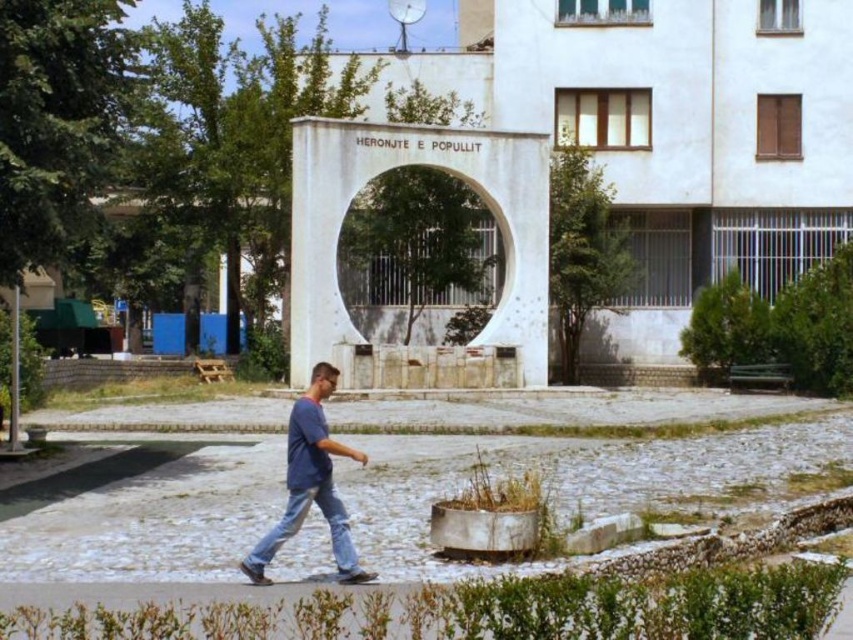
You are a photographer trying to capture the white concrete archway at center and the blue denim jeans at lower center in a single frame. Since you want both objects to be clearly visible, which object should you focus on first to ensure proper depth of field?

The white concrete archway at center is thinner than blue denim jeans at lower center, so you should focus on the blue denim jeans at lower center first to ensure both are in focus.

You are a photographer standing at the edge of the paved area. You want to capture both the blue denim jeans at lower center and the denim at center in your shot. Which object should you focus on first to ensure both are in frame?

Since the blue denim jeans at lower center is taller than the denim at center, you should focus on the blue denim jeans at lower center first to ensure both are in frame.

A man is walking from the left side of the image toward the white concrete archway at center. If the distance between them is 116.83 feet, how many times would the man have to walk the length of a standard American football field to cover this distance?

The distance between the man and the white concrete archway at center is 116.83 feet. A standard American football field is 120 yards long, which converts to 360 feet. Since 116.83 feet is less than 360 feet, the man would need to walk the length of a football field approximately 0.32 times to cover the distance.